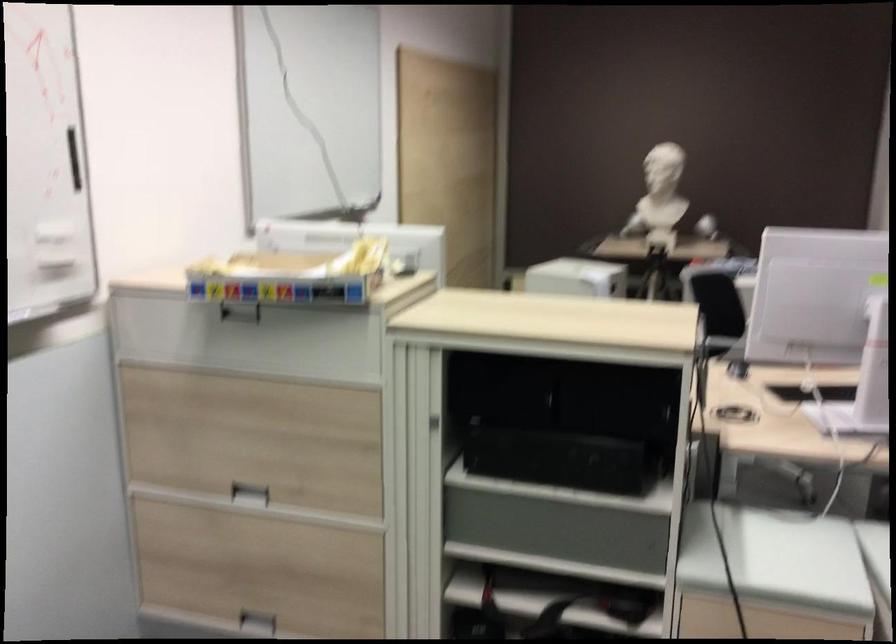
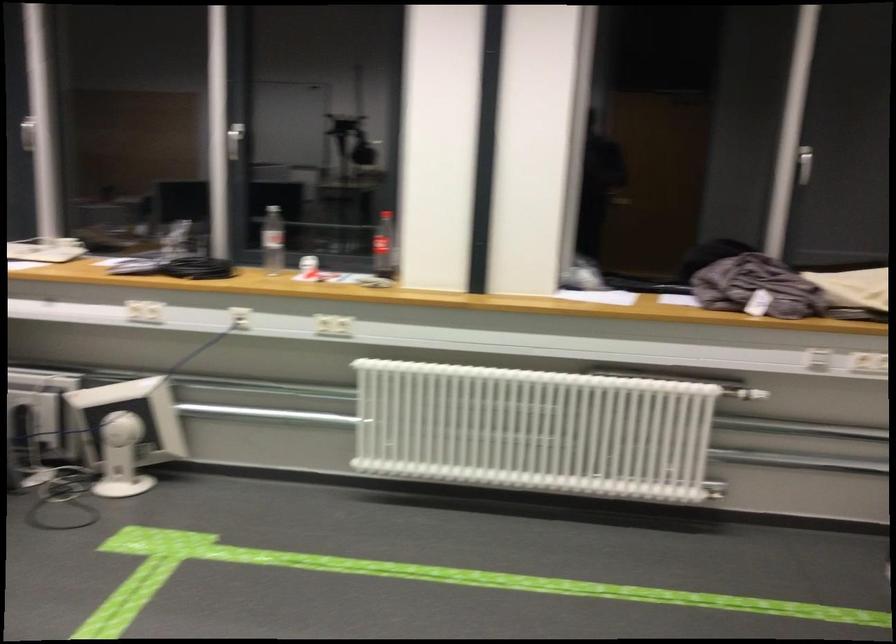
Based on the continuous images, in which direction is the camera rotating?

The camera rotated toward right-down.